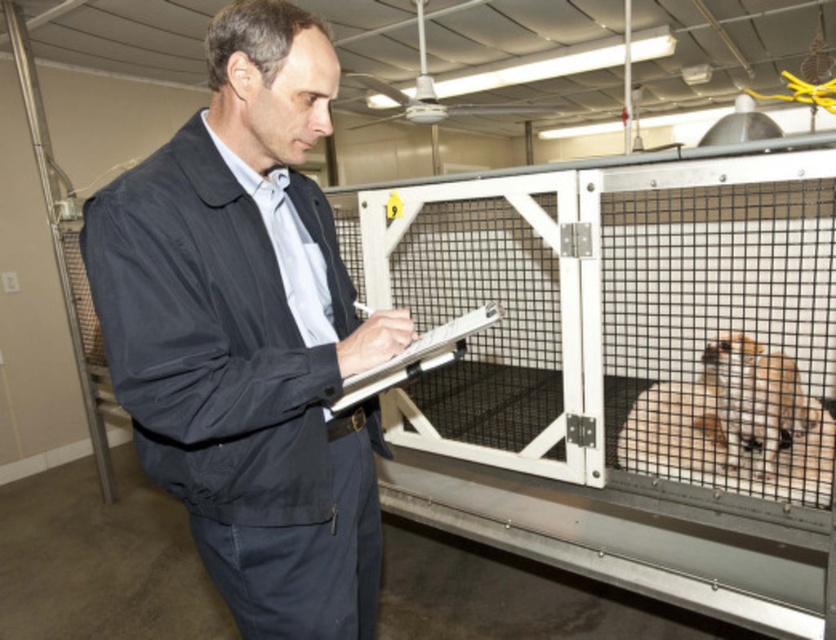
Does point (317, 600) come in front of point (427, 358)?

No, it is not.

Which is in front, point (368, 552) or point (345, 385)?

Positioned in front is point (345, 385).

This screenshot has width=836, height=640. What do you see at coordinates (248, 333) in the screenshot?
I see `dark blue fabric jacket at center` at bounding box center [248, 333].

Where is `dark blue fabric jacket at center`? The height and width of the screenshot is (640, 836). dark blue fabric jacket at center is located at coordinates (248, 333).

Can you confirm if dark blue fabric jacket at center is smaller than light brown fur at right?

Incorrect, dark blue fabric jacket at center is not smaller in size than light brown fur at right.

Does dark blue fabric jacket at center have a larger size compared to light brown fur at right?

Indeed, dark blue fabric jacket at center has a larger size compared to light brown fur at right.

Which is behind, point (258, 168) or point (729, 420)?

The point (729, 420) is behind.

Where is `dark blue fabric jacket at center`? The height and width of the screenshot is (640, 836). dark blue fabric jacket at center is located at coordinates (248, 333).

Between light brown fur at right and white plastic clipboard at center, which one has less height?

Standing shorter between the two is white plastic clipboard at center.

Looking at this image, is light brown fur at right bigger than white plastic clipboard at center?

Yes.

At what (x,y) coordinates should I click in order to perform the action: click on light brown fur at right. Please return your answer as a coordinate pair (x, y). The height and width of the screenshot is (640, 836). Looking at the image, I should click on (757, 400).

Locate an element on the screen. light brown fur at right is located at coordinates (757, 400).